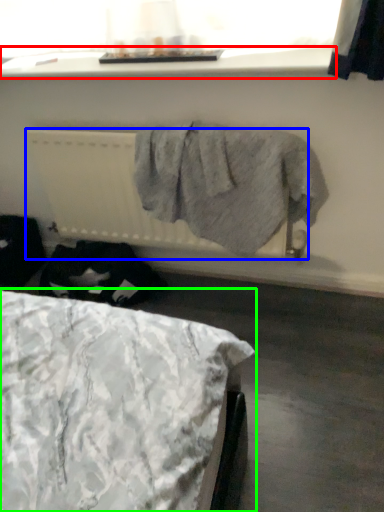
Question: Which is nearer to the window sill (highlighted by a red box)? radiator (highlighted by a blue box) or bed (highlighted by a green box).

Choices:
 (A) radiator
 (B) bed

Answer: (A)